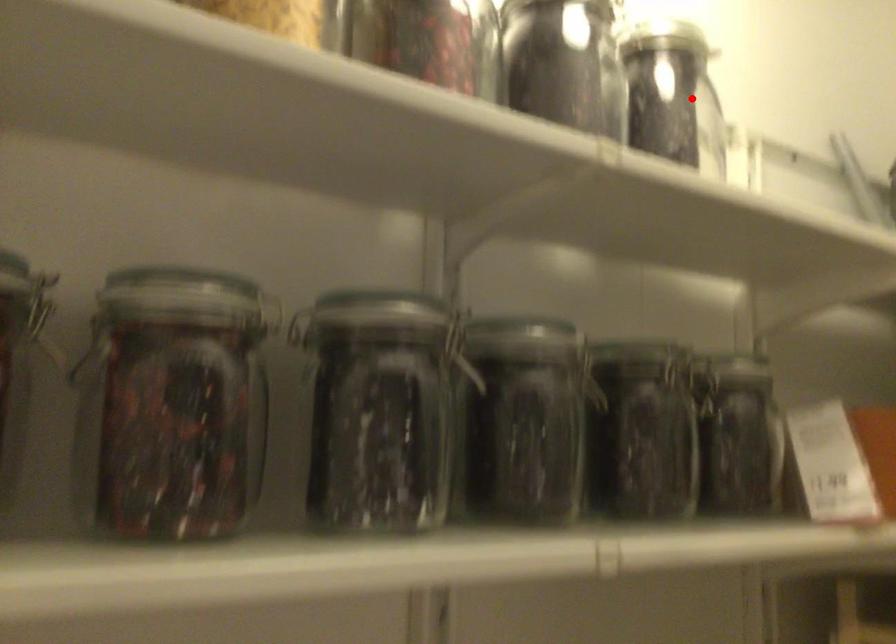
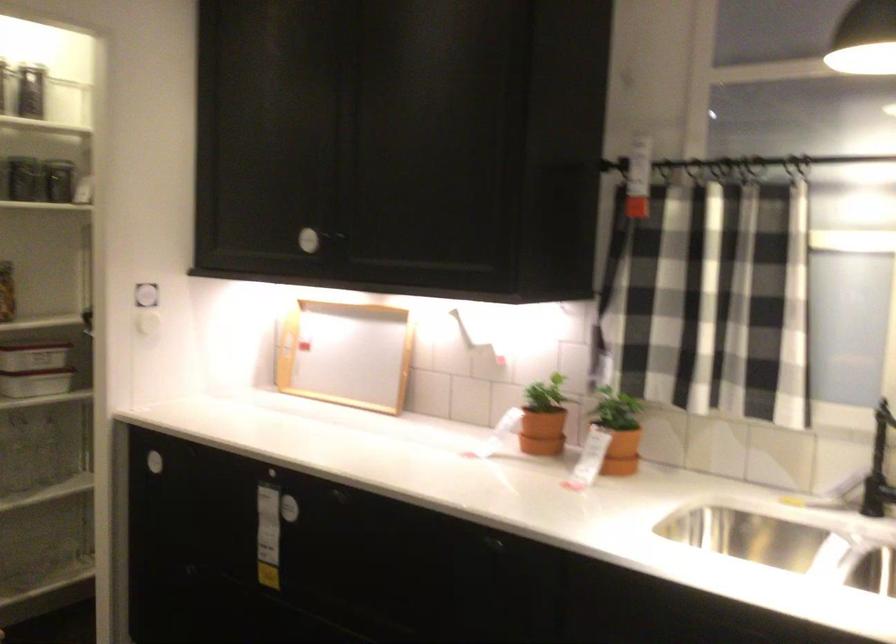
Where in the second image is the point corresponding to the highlighted location from the first image?

(39, 91)